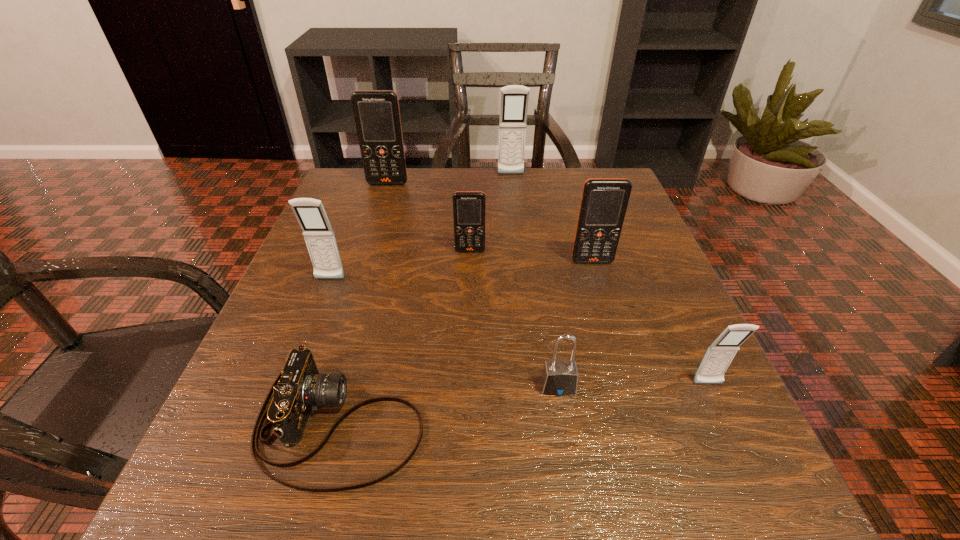
The height and width of the screenshot is (540, 960). In order to click on free point between the third farthest object and the shortest object in this screenshot , I will do `click(405, 337)`.

At what (x,y) coordinates should I click in order to perform the action: click on free space between the rightmost object and the biggest orange cellular telephone. Please return your answer as a coordinate pair (x, y). Looking at the image, I should click on (x=548, y=284).

Locate an element on the screen. blank region between the second biggest gray cellular telephone and the camera is located at coordinates (335, 352).

Image resolution: width=960 pixels, height=540 pixels. I want to click on free space between the smallest orange cellular telephone and the fifth farthest object, so click(400, 265).

Locate an element on the screen. free spot between the fifth farthest object and the shortest object is located at coordinates (335, 352).

Image resolution: width=960 pixels, height=540 pixels. I want to click on empty space between the shortest object and the biggest gray cellular telephone, so click(426, 299).

The image size is (960, 540). Identify the location of the closest object relative to the nearest cellular telephone. (559, 377).

Choose which object is the nearest neighbor to the fifth nearest object. Please provide its 2D coordinates. Your answer should be formatted as a tuple, i.e. [(x, y)], where the tuple contains the x and y coordinates of a point satisfying the conditions above.

[(468, 206)]

Locate an element on the screen. Image resolution: width=960 pixels, height=540 pixels. cellular telephone that stands as the fifth closest to the nearest cellular telephone is located at coordinates (377, 115).

Locate an element on the screen. This screenshot has width=960, height=540. the third closest cellular telephone to the smallest orange cellular telephone is located at coordinates (377, 115).